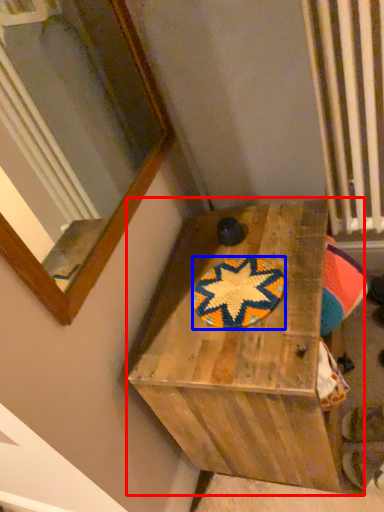
Question: Which of the following is the closest to the observer, furniture (highlighted by a red box) or mat (highlighted by a blue box)?

Choices:
 (A) furniture
 (B) mat

Answer: (A)